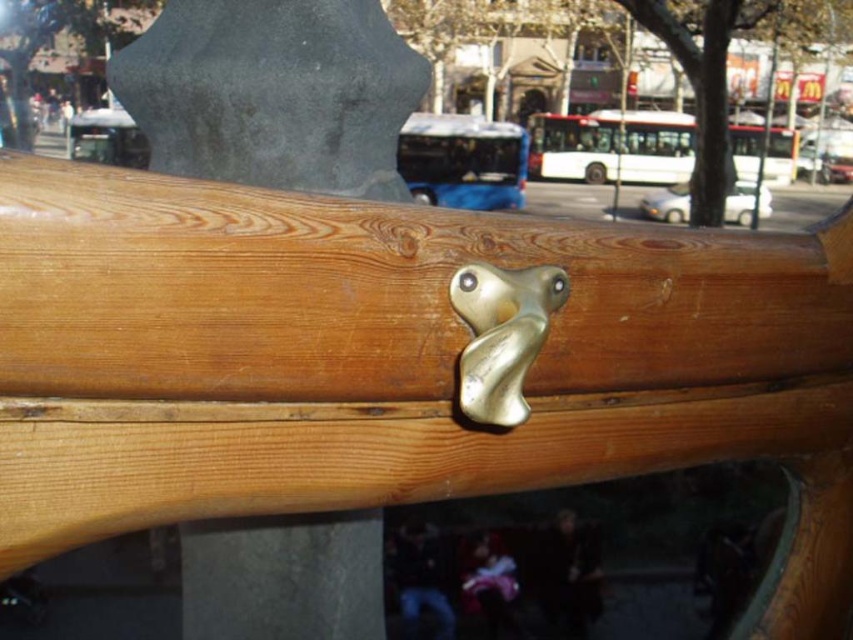
Does matte wood handle at center appear on the left side of gold metallic door handle at center?

Correct, you'll find matte wood handle at center to the left of gold metallic door handle at center.

Does matte wood handle at center come behind gold metallic door handle at center?

Yes, it is.

Image resolution: width=853 pixels, height=640 pixels. I want to click on matte wood handle at center, so click(x=273, y=93).

This screenshot has width=853, height=640. What are the coordinates of `matte wood handle at center` in the screenshot? It's located at (273, 93).